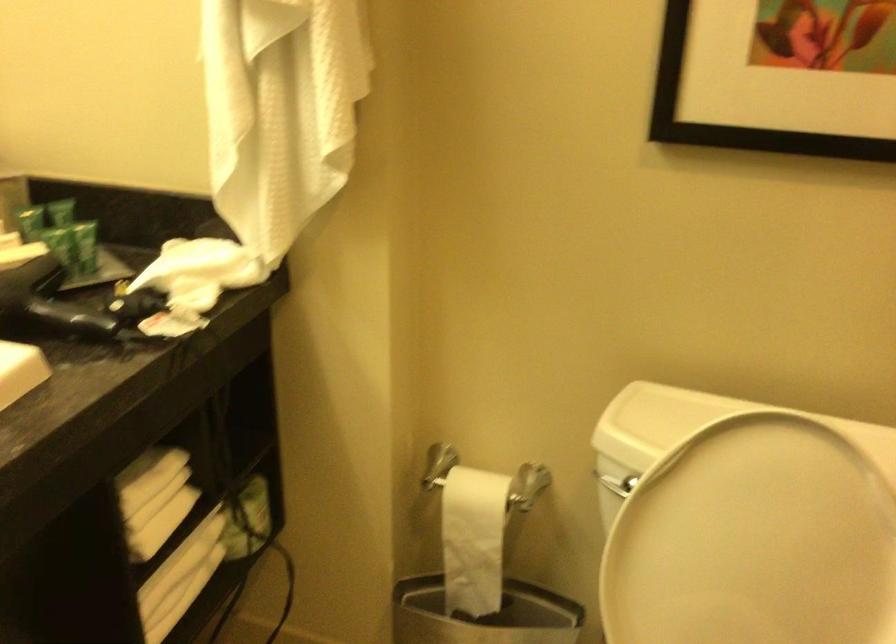
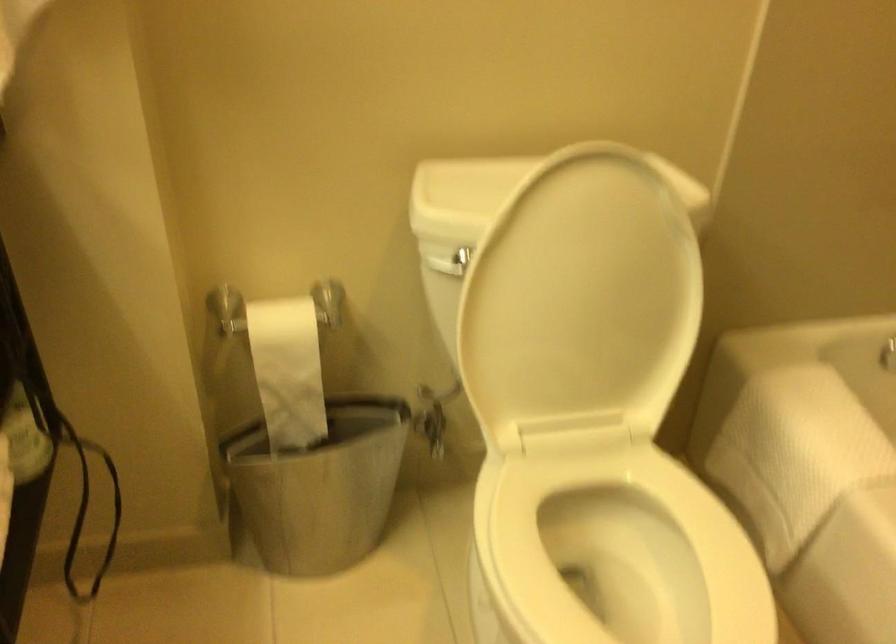
Where in the second image is the point corresponding to (474,535) from the first image?

(288, 370)